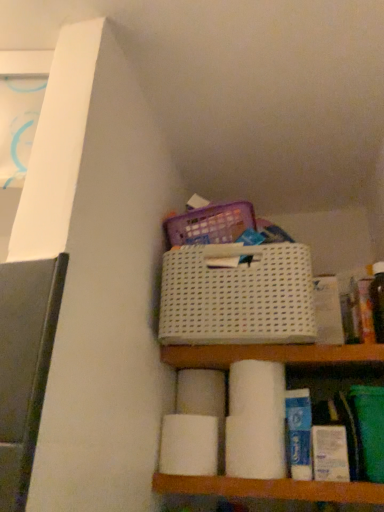
Question: Is white mesh basket at center to the left or to the right of white matte toilet paper at center, which is the 2th toilet paper in back-to-front order, in the image?

Choices:
 (A) left
 (B) right

Answer: (B)

Question: From the image's perspective, relative to white matte toilet paper at center, the 2th toilet paper from the front, is white mesh basket at center above or below?

Choices:
 (A) above
 (B) below

Answer: (A)

Question: Which of these objects is positioned farthest from the white matte toilet paper at center, the 2th toilet paper from the front?

Choices:
 (A) white matte toilet paper at center, which is the third toilet paper in back-to-front order
 (B) white matte toilet paper at lower center, the third toilet paper when ordered from front to back
 (C) white mesh basket at center

Answer: (C)

Question: Which object is the farthest from the white mesh basket at center?

Choices:
 (A) white matte toilet paper at center, the first toilet paper when ordered from front to back
 (B) white matte toilet paper at lower center, the third toilet paper when ordered from front to back
 (C) white matte toilet paper at center, which is the 2th toilet paper in back-to-front order

Answer: (C)